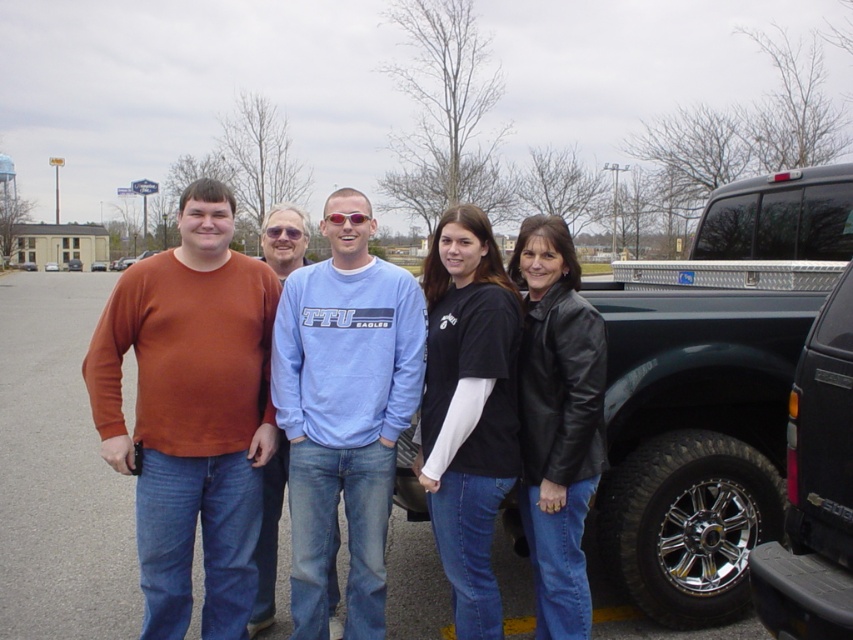
Question: Which of these objects is positioned closest to the black cotton shirt at center?

Choices:
 (A) matte blue shirt at center
 (B) black metallic truck at right
 (C) matte orange sweater at left
 (D) light blue cotton shirt at center

Answer: (D)

Question: Which point is closer to the camera?

Choices:
 (A) black metallic truck at right
 (B) matte orange sweater at left
 (C) matte orange sweater at center

Answer: (A)

Question: Can you confirm if black metallic truck at right is positioned to the right of matte blue shirt at center?

Choices:
 (A) yes
 (B) no

Answer: (A)

Question: Can you confirm if black cotton shirt at center is positioned to the right of black metallic truck at right?

Choices:
 (A) no
 (B) yes

Answer: (A)

Question: Does black cotton shirt at center have a lesser width compared to black metallic truck at right?

Choices:
 (A) yes
 (B) no

Answer: (A)

Question: Which is farther from the matte orange sweater at center?

Choices:
 (A) black cotton shirt at center
 (B) matte orange sweater at left
 (C) black leather jacket at right
 (D) matte blue shirt at center

Answer: (C)